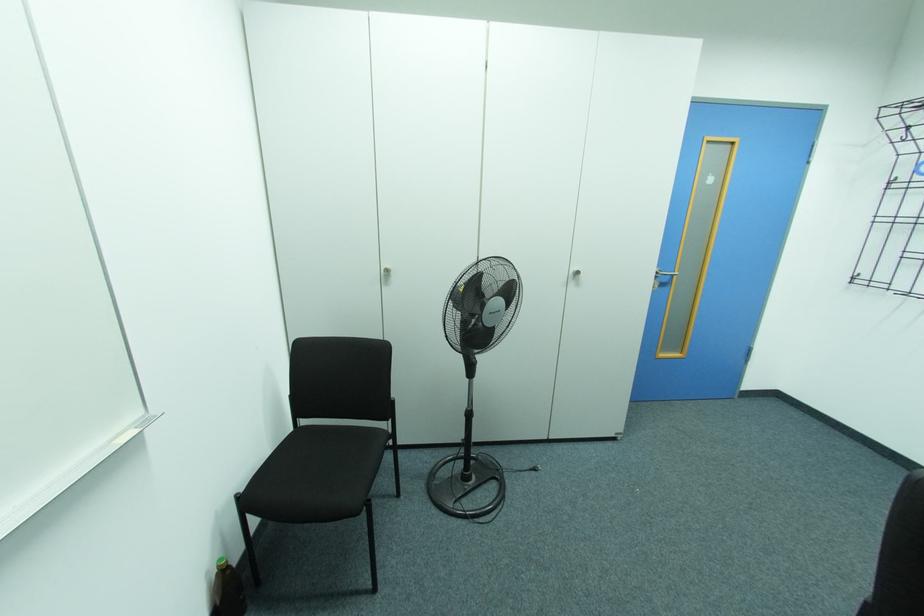
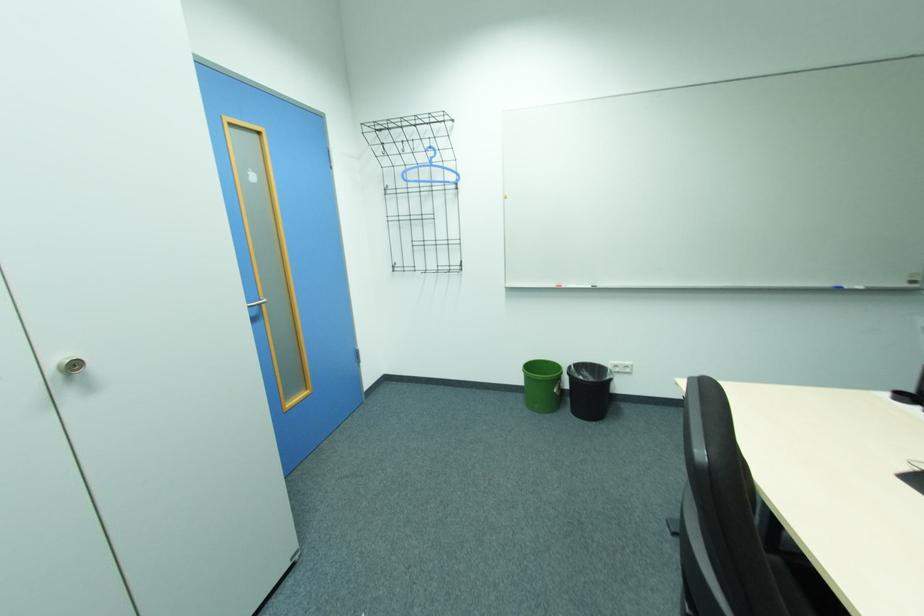
Question: The camera is either moving clockwise (left) or counter-clockwise (right) around the object. The first image is from the beginning of the video and the second image is from the end. Is the camera moving left or right when shooting the video?

Choices:
 (A) Left
 (B) Right

Answer: (A)